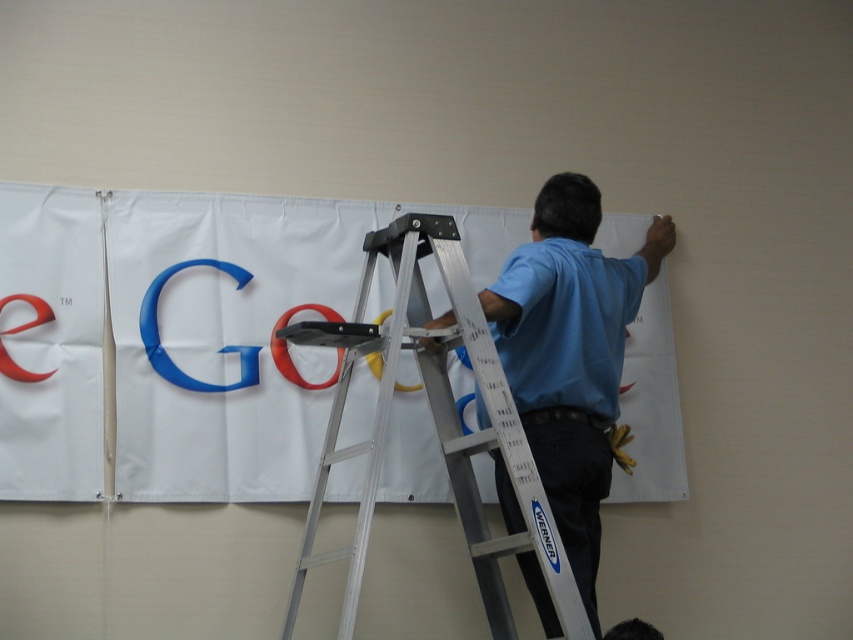
Question: Which is farther from the silver/aluminum step ladder at center?

Choices:
 (A) blue shirt at upper center
 (B) white fabric banner at upper center

Answer: (B)

Question: Which point appears farthest from the camera in this image?

Choices:
 (A) (471, 211)
 (B) (547, 291)
 (C) (392, 253)

Answer: (A)

Question: Is white fabric banner at upper center in front of silver/aluminum step ladder at center?

Choices:
 (A) no
 (B) yes

Answer: (A)

Question: Where is white fabric banner at upper center located in relation to silver/aluminum step ladder at center in the image?

Choices:
 (A) right
 (B) left

Answer: (B)

Question: Which point is closer to the camera taking this photo?

Choices:
 (A) (547, 408)
 (B) (178, 308)
 (C) (463, 304)

Answer: (C)

Question: Is blue shirt at upper center above silver/aluminum step ladder at center?

Choices:
 (A) no
 (B) yes

Answer: (B)